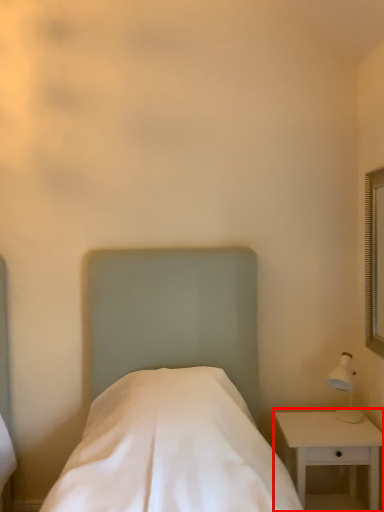
Question: From the image, what is the correct spatial relationship of nightstand (annotated by the red box) in relation to bed?

Choices:
 (A) left
 (B) right

Answer: (B)